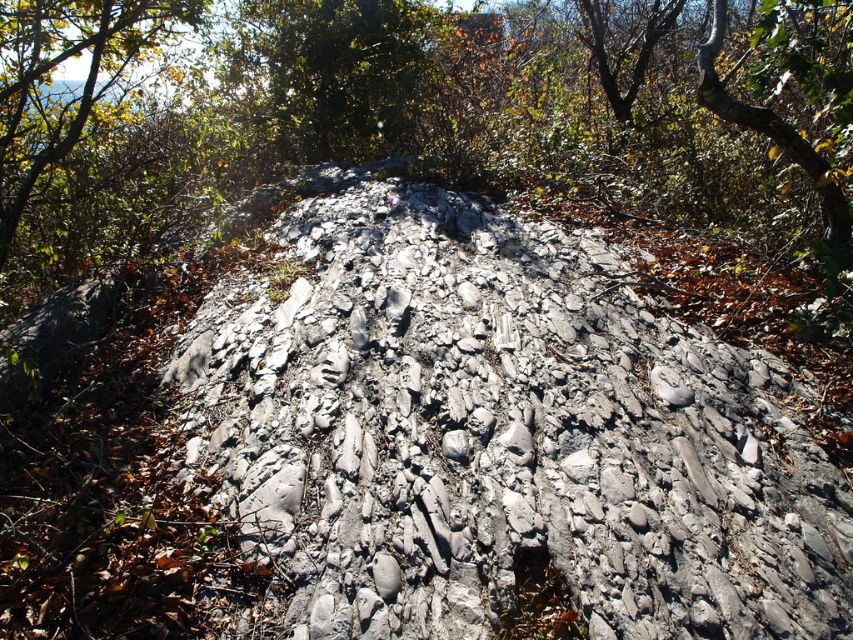
You are standing at the base of the rock mound and want to find the gray rocky dirt track at center. According to the coordinates provided, in which direction should you walk to reach it?

The gray rocky dirt track at center is located at coordinates point [502,435]. Since these coordinates are relative to the image, walking towards the center of the image where the track is positioned would lead you to it.

You are standing at the base of the gray rocky dirt track at center and want to reach the green leafy tree at upper center. Which direction should you move to get closer to the tree?

To reach the green leafy tree at upper center, you should move forward since the gray rocky dirt track at center is in front of the tree.